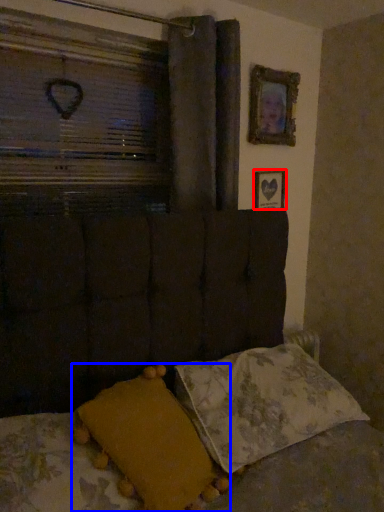
Question: Which point is closer to the camera, picture frame (highlighted by a red box) or pillow (highlighted by a blue box)?

Choices:
 (A) picture frame
 (B) pillow

Answer: (B)